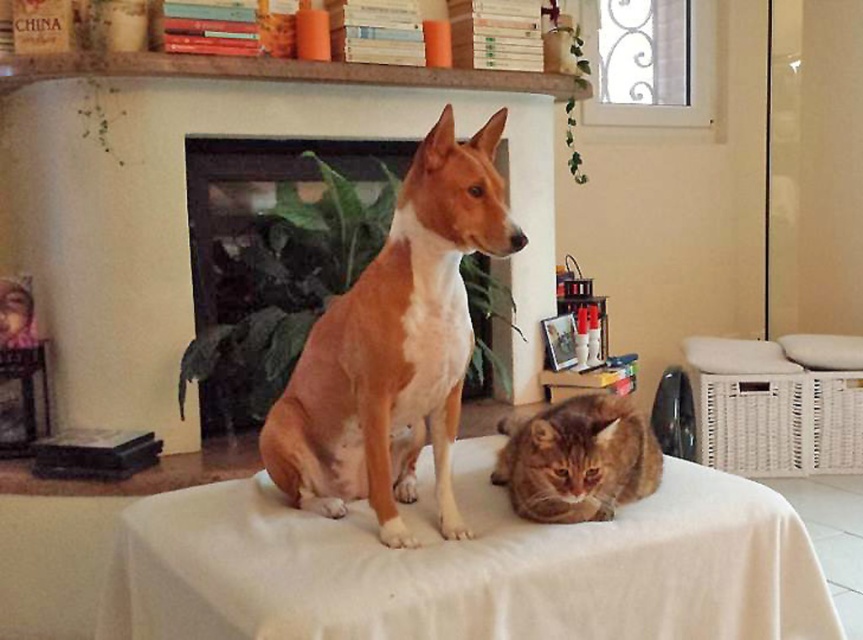
You are a photographer setting up a camera to capture the dog and cat on the table. The camera is positioned to focus on the brown smooth dog at center. Will the orange tabby cat at lower center be in the same frame if the camera is aimed at the dog?

Yes, the orange tabby cat at lower center will be in the same frame because the brown smooth dog at center is above it, meaning the cat is positioned lower but still within the camera view when focused on the dog.